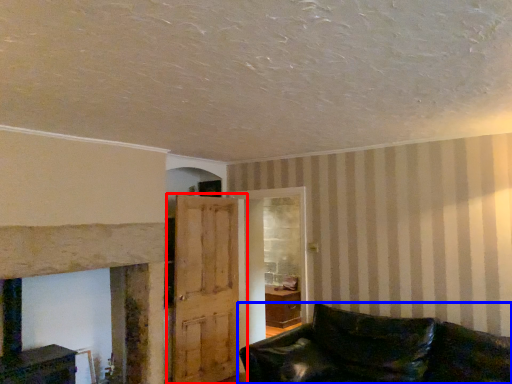
Question: Which of the following is the closest to the observer, door (highlighted by a red box) or studio couch (highlighted by a blue box)?

Choices:
 (A) door
 (B) studio couch

Answer: (B)